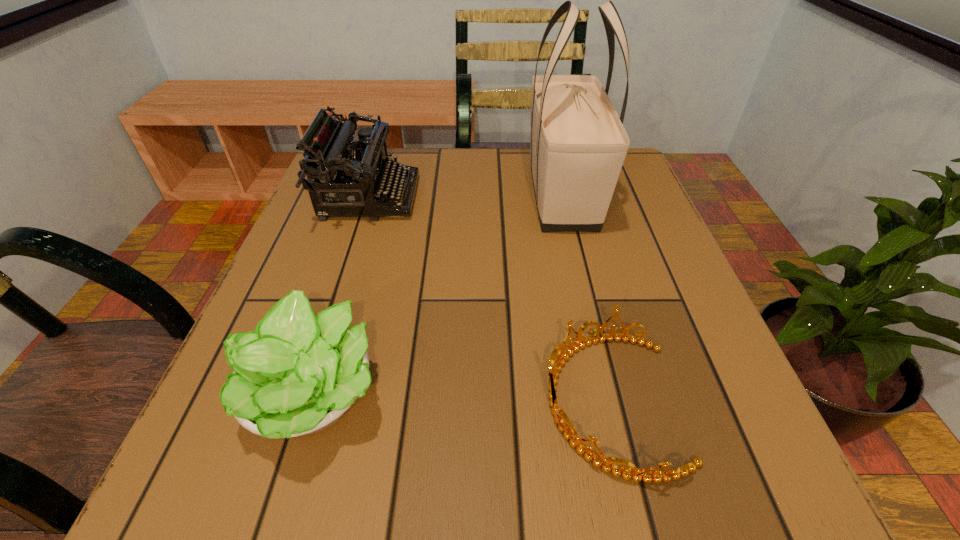
Locate an element on the screen. The width and height of the screenshot is (960, 540). vacant area between the lettuce and the third shortest object is located at coordinates (341, 296).

Identify the location of unoccupied area between the second tallest object and the tiara. (490, 299).

Where is `empty location between the shopping bag and the lettuce`? empty location between the shopping bag and the lettuce is located at coordinates (x=438, y=294).

Where is `free space that is in between the lettuce and the tiara`? free space that is in between the lettuce and the tiara is located at coordinates 462,398.

Locate an element on the screen. Image resolution: width=960 pixels, height=540 pixels. free spot between the third shortest object and the tiara is located at coordinates (490, 299).

This screenshot has height=540, width=960. I want to click on vacant space in between the shopping bag and the lettuce, so click(438, 294).

Select which object is the third closest to the lettuce. Please provide its 2D coordinates. Your answer should be formatted as a tuple, i.e. [(x, y)], where the tuple contains the x and y coordinates of a point satisfying the conditions above.

[(578, 146)]

Find the location of `object that ranks as the third closest to the tiara`. object that ranks as the third closest to the tiara is located at coordinates (365, 174).

Identify the location of free spot that satisfies the following two spatial constraints: 1. with handles facing forward on the shopping bag; 2. on the front-facing side of the tiara. (612, 401).

Locate an element on the screen. free spot that satisfies the following two spatial constraints: 1. on the back side of the lettuce; 2. on the keyboard of the typewriter is located at coordinates (373, 197).